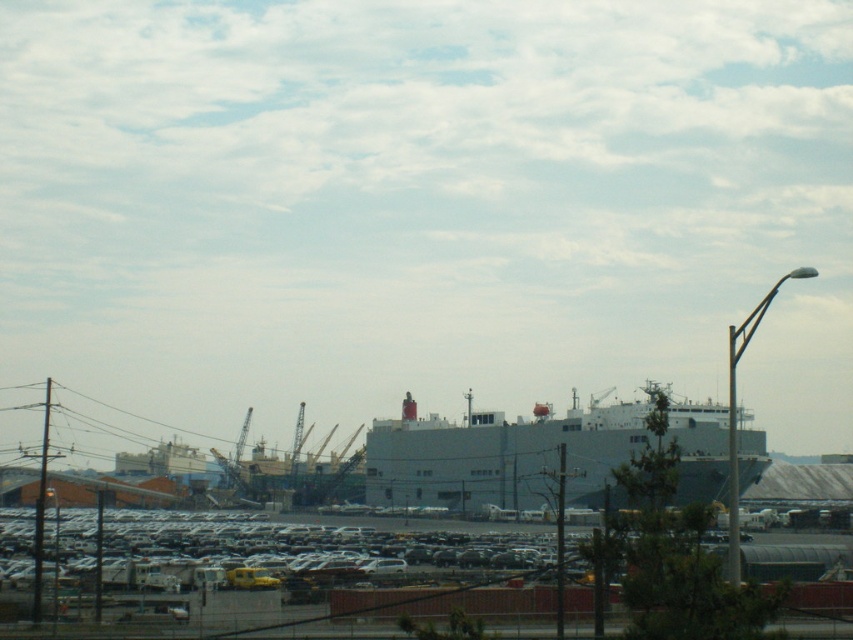
Question: Can you confirm if white matte parking lot at lower center is thinner than gray matte ship at center?

Choices:
 (A) no
 (B) yes

Answer: (A)

Question: Which point is farther to the camera?

Choices:
 (A) (422, 454)
 (B) (705, 579)

Answer: (A)

Question: Which object appears farthest from the camera in this image?

Choices:
 (A) gray matte ship at center
 (B) white matte parking lot at lower center

Answer: (A)

Question: Considering the relative positions of white matte parking lot at lower center and gray matte ship at center in the image provided, where is white matte parking lot at lower center located with respect to gray matte ship at center?

Choices:
 (A) left
 (B) right

Answer: (A)

Question: Which point is closer to the camera taking this photo?

Choices:
 (A) (15, 554)
 (B) (682, 460)

Answer: (A)

Question: Can you confirm if white matte parking lot at lower center is positioned to the right of gray matte ship at center?

Choices:
 (A) no
 (B) yes

Answer: (A)